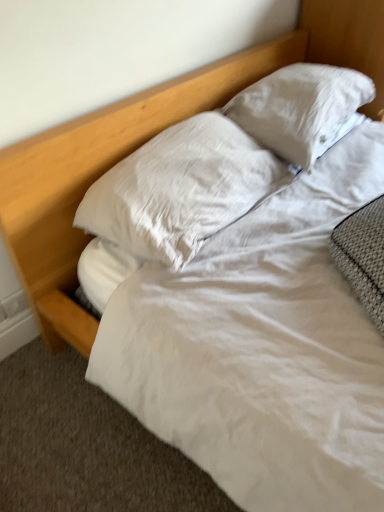
Question: Is white soft pillow at center, the 2th pillow viewed from the right, wider or thinner than white satin pillow at upper center, marked as the first pillow in a right-to-left arrangement?

Choices:
 (A) wide
 (B) thin

Answer: (A)

Question: From the image's perspective, is white soft pillow at center, the 1th pillow in the left-to-right sequence, positioned above or below white satin pillow at upper center, marked as the first pillow in a right-to-left arrangement?

Choices:
 (A) above
 (B) below

Answer: (B)

Question: Considering the positions of white soft pillow at center, the 1th pillow in the left-to-right sequence, and white satin pillow at upper center, marked as the first pillow in a right-to-left arrangement, in the image, is white soft pillow at center, the 1th pillow in the left-to-right sequence, taller or shorter than white satin pillow at upper center, marked as the first pillow in a right-to-left arrangement,?

Choices:
 (A) tall
 (B) short

Answer: (B)

Question: In terms of size, does white satin pillow at upper center, which is counted as the 2th pillow, starting from the left, appear bigger or smaller than white soft pillow at center, the 2th pillow viewed from the right?

Choices:
 (A) small
 (B) big

Answer: (B)

Question: From the image's perspective, relative to white soft pillow at center, the 1th pillow in the left-to-right sequence, is white satin pillow at upper center, which is counted as the 2th pillow, starting from the left, above or below?

Choices:
 (A) below
 (B) above

Answer: (B)

Question: Is white satin pillow at upper center, marked as the first pillow in a right-to-left arrangement, to the left or to the right of white soft pillow at center, the 2th pillow viewed from the right, in the image?

Choices:
 (A) right
 (B) left

Answer: (A)

Question: Considering their positions, is white satin pillow at upper center, which is counted as the 2th pillow, starting from the left, located in front of or behind white soft pillow at center, the 1th pillow in the left-to-right sequence?

Choices:
 (A) behind
 (B) front

Answer: (A)